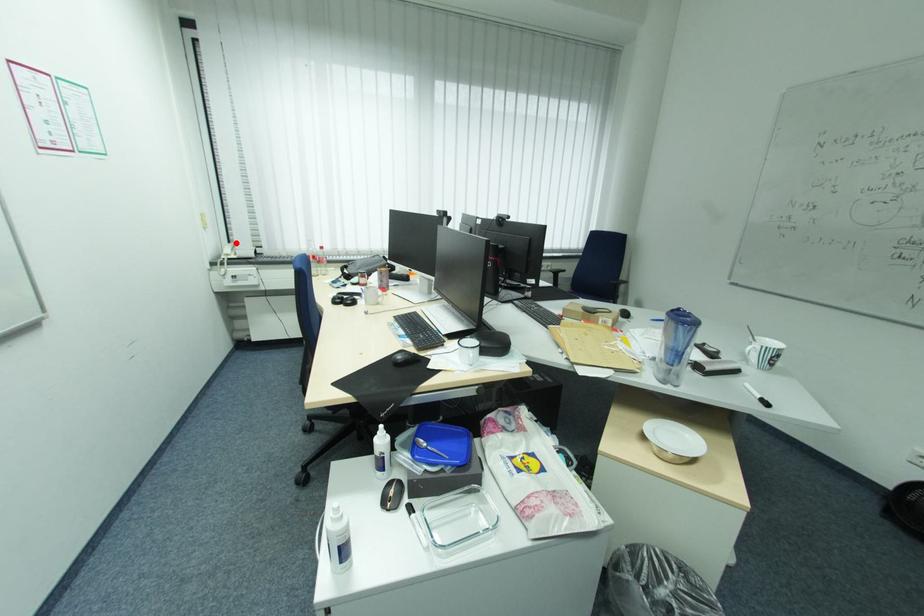
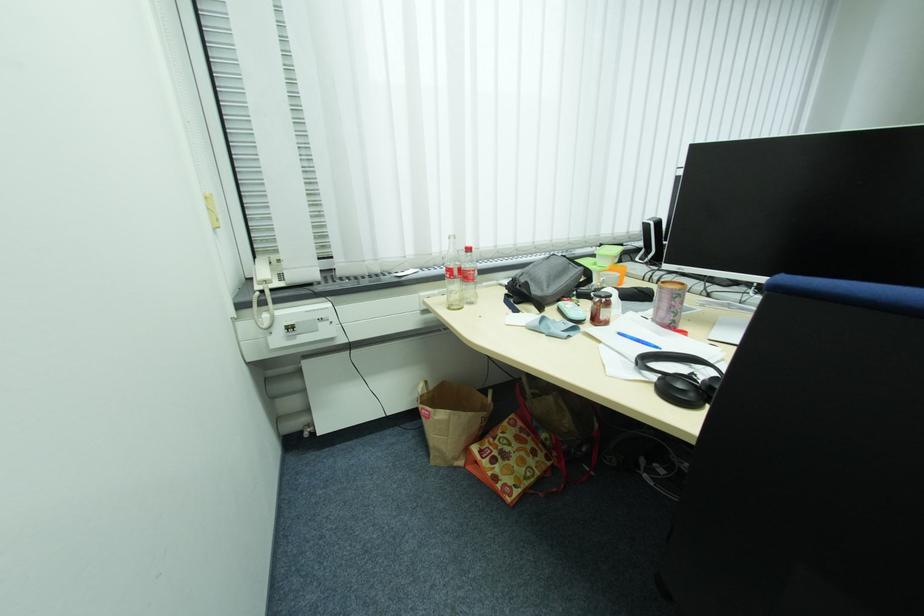
Locate, in the second image, the point that corresponds to the highlighted location in the first image.

(261, 256)